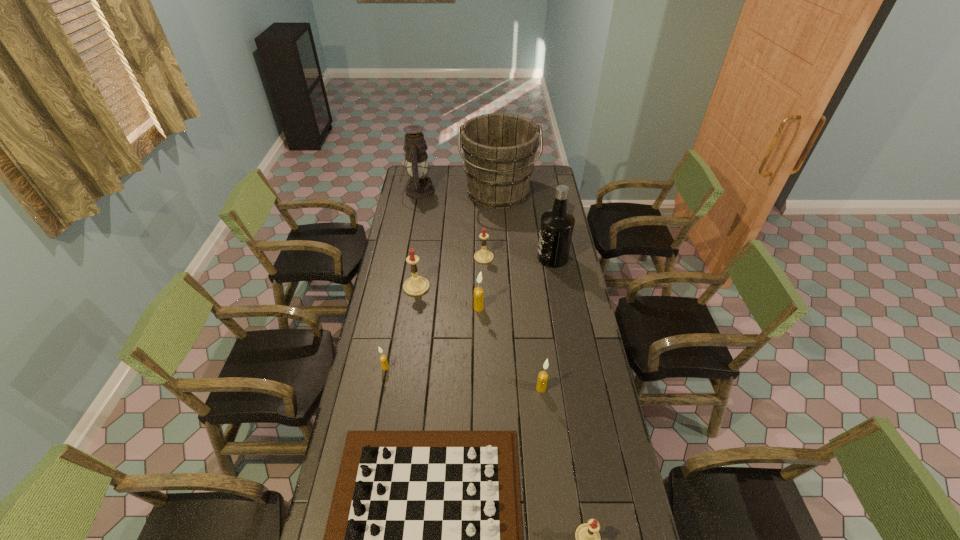
You are a GUI agent. You are given a task and a screenshot of the screen. Output one action in this format:
    pyautogui.click(x=<x>, y=<y>)
    Task: Click on the free location at the far edge
    This screenshot has width=960, height=540.
    Given the screenshot: What is the action you would take?
    pyautogui.click(x=460, y=168)

Identify the location of free spot at the left edge of the desktop. The width and height of the screenshot is (960, 540). (388, 315).

I want to click on vacant point at the right edge, so click(x=612, y=425).

Locate an element on the screen. The height and width of the screenshot is (540, 960). blank region between the eighth farthest object and the liquor is located at coordinates (547, 323).

Find the location of `vacant region between the black liquor and the second cream candle from left to right`. vacant region between the black liquor and the second cream candle from left to right is located at coordinates (516, 283).

Identify the location of vacant point located between the sixth nearest object and the black liquor. This screenshot has height=540, width=960. (485, 272).

This screenshot has height=540, width=960. Identify the location of vacant area that lies between the bucket and the liquor. click(525, 226).

Find the location of a particular element. The height and width of the screenshot is (540, 960). vacant region between the second red candle from right to left and the farthest cream candle is located at coordinates (481, 282).

Where is `free spot between the leftmost red candle and the liquor`? The width and height of the screenshot is (960, 540). free spot between the leftmost red candle and the liquor is located at coordinates (485, 272).

In order to click on vacant point located between the fourth nearest object and the liquor in this screenshot , I will do tap(469, 313).